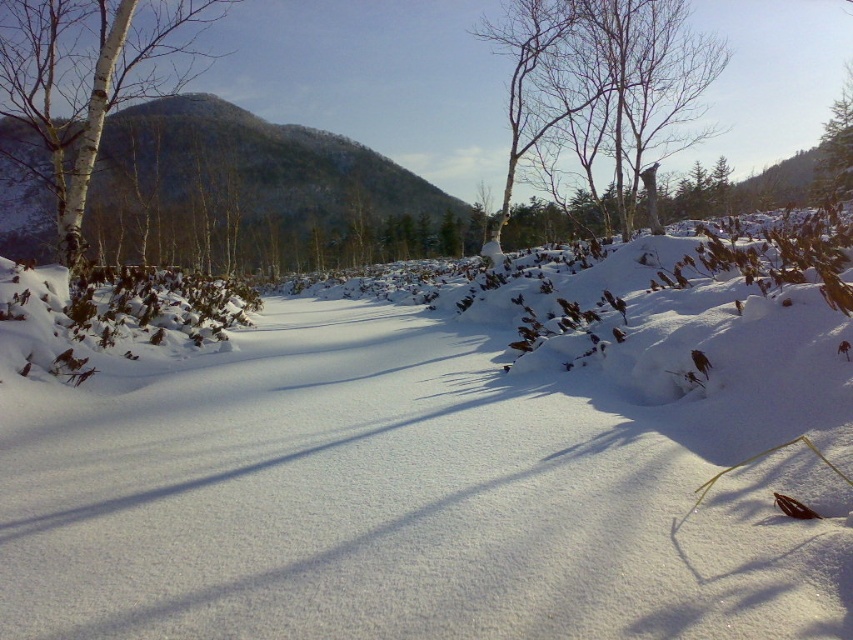
Question: Which object appears farthest from the camera in this image?

Choices:
 (A) snowy forested hill at upper left
 (B) bare branches at upper center
 (C) white bark tree at left
 (D) white fluffy snow at center

Answer: (A)

Question: Is white fluffy snow at center positioned before white bark tree at left?

Choices:
 (A) yes
 (B) no

Answer: (A)

Question: Which of the following is the farthest from the observer?

Choices:
 (A) white bark tree at left
 (B) white fluffy snow at center

Answer: (A)

Question: Is white fluffy snow at center above bare branches at upper center?

Choices:
 (A) yes
 (B) no

Answer: (B)

Question: Is white fluffy snow at center below white bark tree at left?

Choices:
 (A) yes
 (B) no

Answer: (A)

Question: Based on their relative distances, which object is farther from the white bark tree at left?

Choices:
 (A) white fluffy snow at center
 (B) snowy forested hill at upper left

Answer: (A)